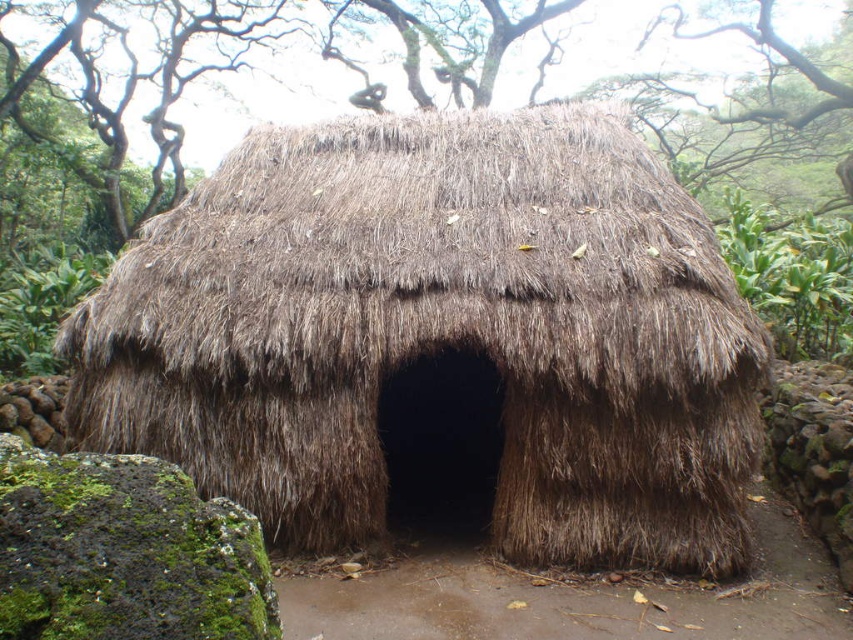
Does brown thatch hut at center appear on the right side of green leafy plant at upper right?

Incorrect, brown thatch hut at center is not on the right side of green leafy plant at upper right.

Does brown thatch hut at center appear on the left side of green leafy plant at upper right?

Indeed, brown thatch hut at center is positioned on the left side of green leafy plant at upper right.

Where is `brown thatch hut at center`? brown thatch hut at center is located at coordinates (438, 333).

You are a GUI agent. You are given a task and a screenshot of the screen. Output one action in this format:
    pyautogui.click(x=<x>, y=<y>)
    Task: Click on the brown thatch hut at center
    This screenshot has width=853, height=640.
    Given the screenshot: What is the action you would take?
    pyautogui.click(x=438, y=333)